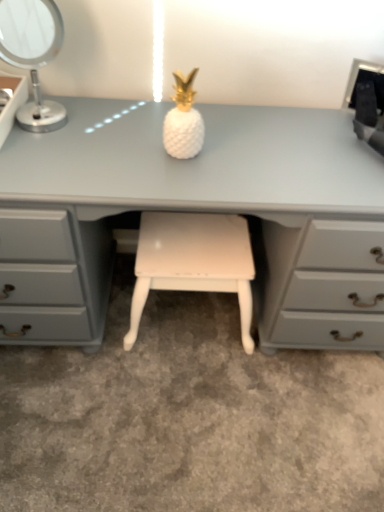
Where is `vacant area that is in front of white glossy pineapple at center`? The height and width of the screenshot is (512, 384). vacant area that is in front of white glossy pineapple at center is located at coordinates (174, 180).